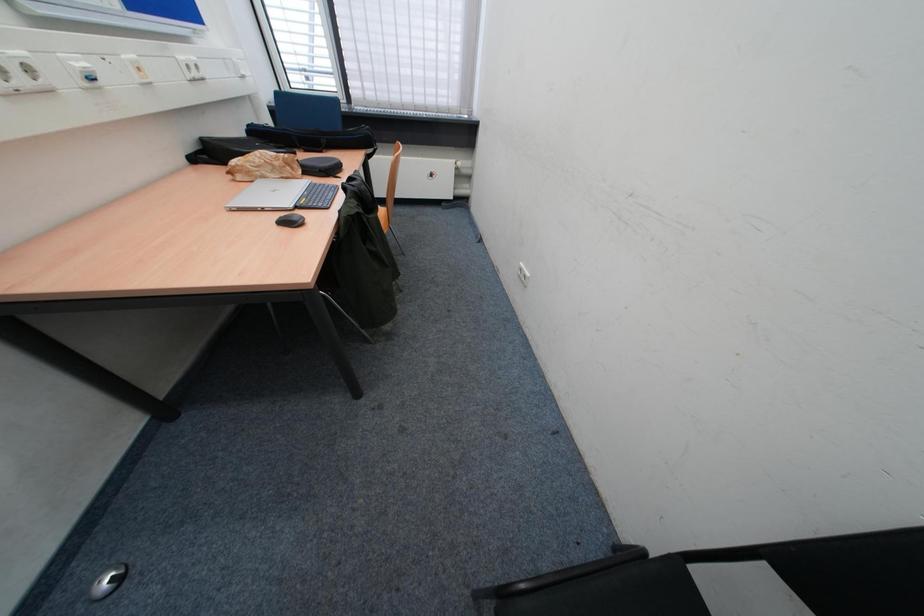
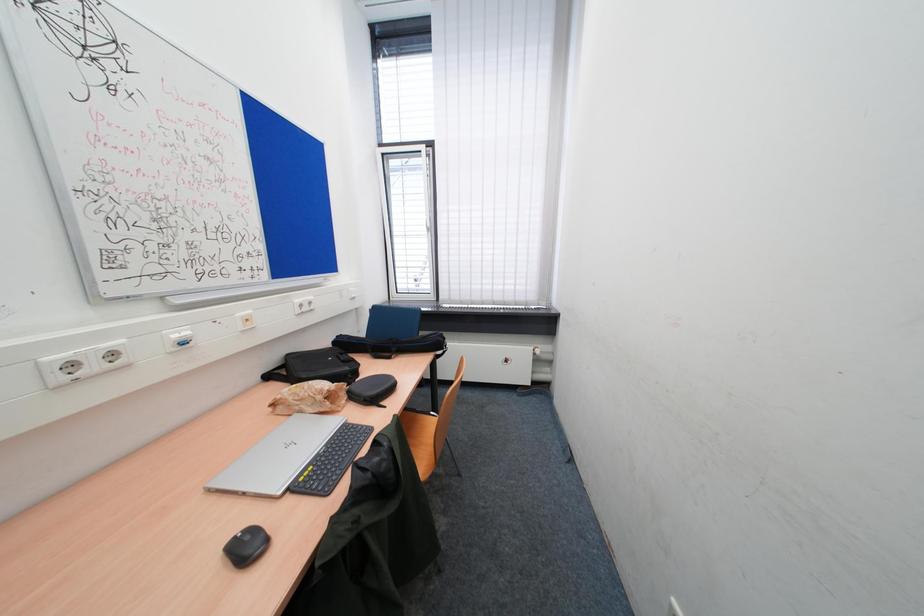
The images are taken continuously from a first-person perspective. In which direction is your viewpoint rotating?

The camera's rotation is toward left-up.